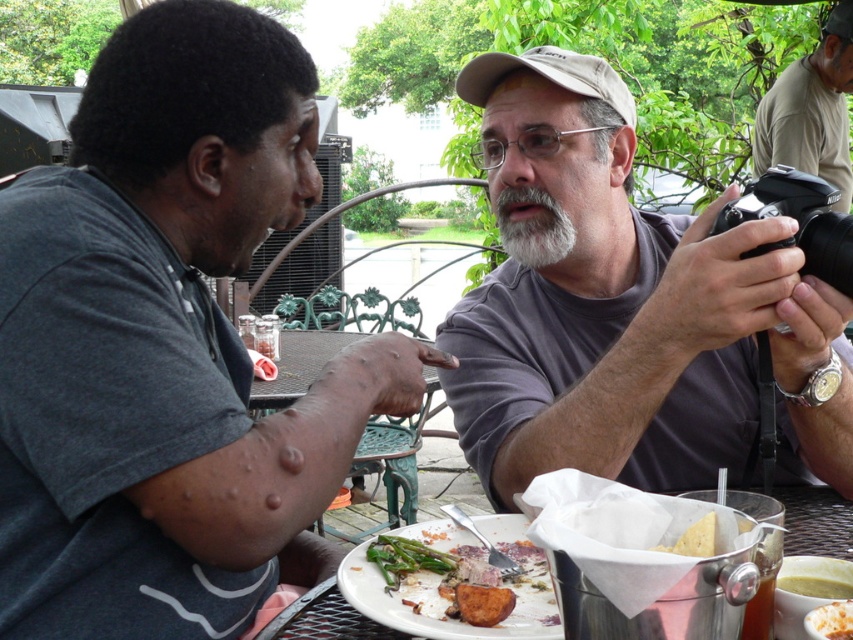
Is green asparagus at center thinner than brown crispy bread at center?

No, green asparagus at center is not thinner than brown crispy bread at center.

Between green asparagus at center and brown crispy bread at center, which one is positioned lower?

Positioned lower is brown crispy bread at center.

This screenshot has width=853, height=640. Describe the element at coordinates (460, 577) in the screenshot. I see `green asparagus at center` at that location.

Where is `green asparagus at center`? green asparagus at center is located at coordinates (460, 577).

Can you confirm if black plastic camera at upper right is thinner than silver metallic bucket at lower center?

Yes, black plastic camera at upper right is thinner than silver metallic bucket at lower center.

Between black plastic camera at upper right and silver metallic bucket at lower center, which one has less height?

Standing shorter between the two is silver metallic bucket at lower center.

Between point (747, 195) and point (379, 496), which one is positioned in front?

Point (747, 195) is more forward.

Find the location of a particular element. This screenshot has height=640, width=853. black plastic camera at upper right is located at coordinates (798, 221).

Does green asparagus at center have a smaller size compared to white matte beard at center?

Incorrect, green asparagus at center is not smaller in size than white matte beard at center.

Which is below, green asparagus at center or white matte beard at center?

green asparagus at center

In order to click on green asparagus at center in this screenshot , I will do `click(460, 577)`.

Where is `green asparagus at center`? green asparagus at center is located at coordinates (460, 577).